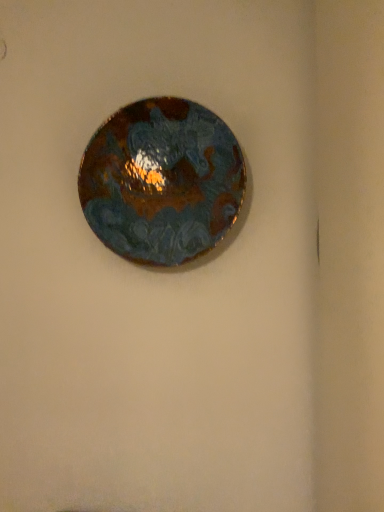
What do you see at coordinates (162, 181) in the screenshot?
I see `rusty metallic platter at center` at bounding box center [162, 181].

The width and height of the screenshot is (384, 512). I want to click on rusty metallic platter at center, so click(162, 181).

Where is `rusty metallic platter at center`? The height and width of the screenshot is (512, 384). rusty metallic platter at center is located at coordinates (162, 181).